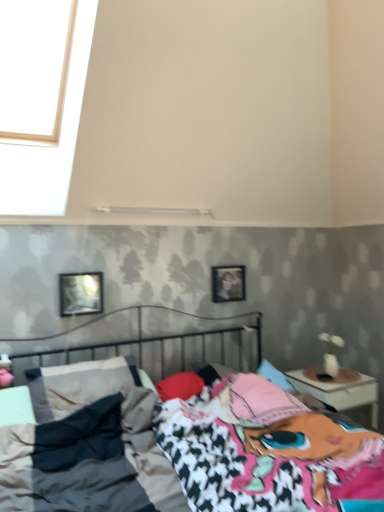
Question: Considering the relative positions of metallic reflective picture frame at upper left, the second picture frame from the right, and metallic bed at center in the image provided, is metallic reflective picture frame at upper left, the second picture frame from the right, to the left of metallic bed at center from the viewer's perspective?

Choices:
 (A) no
 (B) yes

Answer: (B)

Question: Can you confirm if metallic reflective picture frame at upper left, the second picture frame from the right, is shorter than metallic bed at center?

Choices:
 (A) yes
 (B) no

Answer: (A)

Question: From the image's perspective, would you say metallic reflective picture frame at upper left, the 2th picture frame viewed from the back, is shown under metallic bed at center?

Choices:
 (A) no
 (B) yes

Answer: (A)

Question: Is metallic reflective picture frame at upper left, marked as the 1th picture frame in a left-to-right arrangement, located outside metallic bed at center?

Choices:
 (A) no
 (B) yes

Answer: (B)

Question: From the image's perspective, is metallic reflective picture frame at upper left, the 2th picture frame viewed from the back, over metallic bed at center?

Choices:
 (A) no
 (B) yes

Answer: (B)

Question: Is wooden frame at center, marked as the second picture frame in a left-to-right arrangement, wider or thinner than metallic reflective picture frame at upper left, marked as the 1th picture frame in a left-to-right arrangement?

Choices:
 (A) wide
 (B) thin

Answer: (B)

Question: Looking at the image, does wooden frame at center, arranged as the 1th picture frame when viewed from the right, seem bigger or smaller compared to metallic reflective picture frame at upper left, marked as the 1th picture frame in a front-to-back arrangement?

Choices:
 (A) small
 (B) big

Answer: (A)

Question: Is wooden frame at center, marked as the second picture frame in a left-to-right arrangement, to the left or to the right of metallic reflective picture frame at upper left, the 2th picture frame viewed from the back, in the image?

Choices:
 (A) left
 (B) right

Answer: (B)

Question: Is wooden frame at center, placed as the first picture frame when sorted from back to front, inside or outside of metallic reflective picture frame at upper left, the 2th picture frame viewed from the back?

Choices:
 (A) outside
 (B) inside

Answer: (A)

Question: In terms of height, does white glossy nightstand at right look taller or shorter compared to wooden frame at center, which ranks as the second picture frame in front-to-back order?

Choices:
 (A) short
 (B) tall

Answer: (B)

Question: Would you say white glossy nightstand at right is to the left or to the right of wooden frame at center, marked as the second picture frame in a left-to-right arrangement, in the picture?

Choices:
 (A) right
 (B) left

Answer: (A)

Question: Is white glossy nightstand at right inside the boundaries of wooden frame at center, marked as the second picture frame in a left-to-right arrangement, or outside?

Choices:
 (A) outside
 (B) inside

Answer: (A)

Question: Considering the positions of point (370, 393) and point (236, 293), is point (370, 393) closer or farther from the camera than point (236, 293)?

Choices:
 (A) closer
 (B) farther

Answer: (A)

Question: Is point (100, 282) closer or farther from the camera than point (223, 449)?

Choices:
 (A) closer
 (B) farther

Answer: (B)

Question: From a real-world perspective, is metallic reflective picture frame at upper left, marked as the 1th picture frame in a front-to-back arrangement, physically located above or below metallic bed at center?

Choices:
 (A) below
 (B) above

Answer: (B)